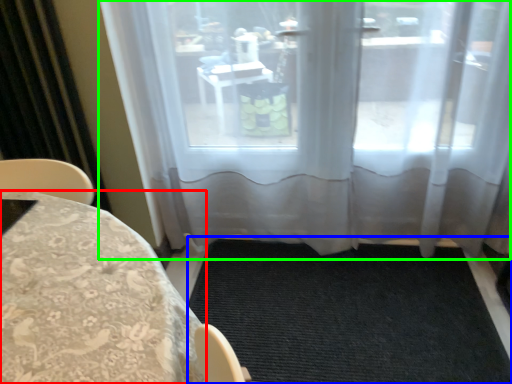
Question: Estimate the real-world distances between objects in this image. Which object is closer to furniture (highlighted by a red box), doormat (highlighted by a blue box) or window (highlighted by a green box)?

Choices:
 (A) doormat
 (B) window

Answer: (A)